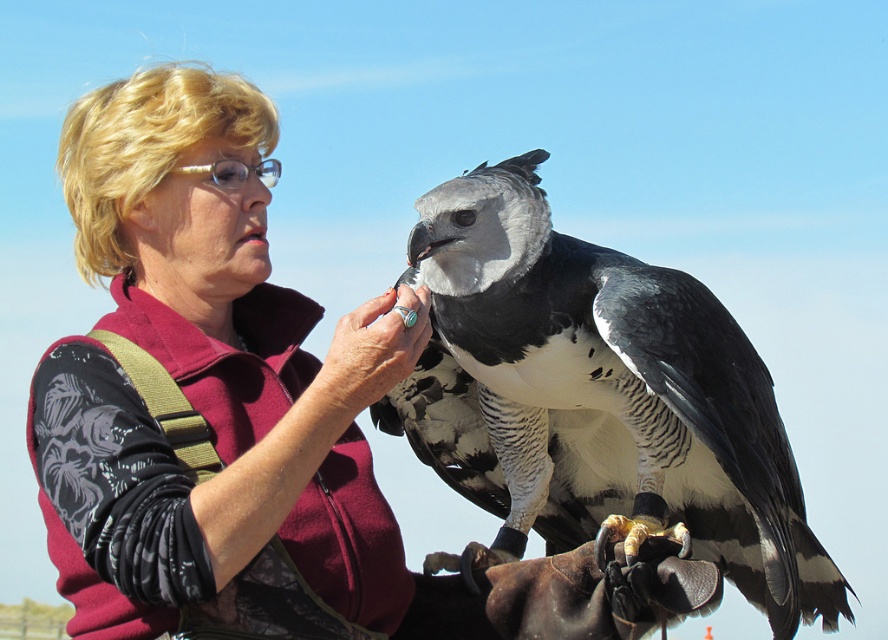
Who is shorter, maroon fabric at center or turquoise ring at center?

turquoise ring at center

Which is below, maroon fabric at center or turquoise ring at center?

Positioned lower is maroon fabric at center.

Which is behind, point (346, 529) or point (387, 296)?

The point (346, 529) is more distant.

Locate an element on the screen. maroon fabric at center is located at coordinates (204, 376).

Between gray/white feathers at center and turquoise ring at center, which one appears on the right side from the viewer's perspective?

Positioned to the right is gray/white feathers at center.

Identify the location of gray/white feathers at center. This screenshot has width=888, height=640. (599, 397).

The height and width of the screenshot is (640, 888). Describe the element at coordinates (204, 376) in the screenshot. I see `maroon fabric at center` at that location.

Which is behind, point (172, 275) or point (439, 312)?

The point (172, 275) is behind.

Identify the location of maroon fabric at center. The image size is (888, 640). (204, 376).